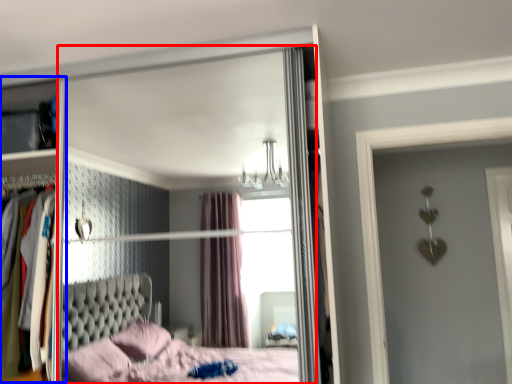
Question: Which point is closer to the camera, mirror (highlighted by a red box) or dresser (highlighted by a blue box)?

Choices:
 (A) mirror
 (B) dresser

Answer: (A)